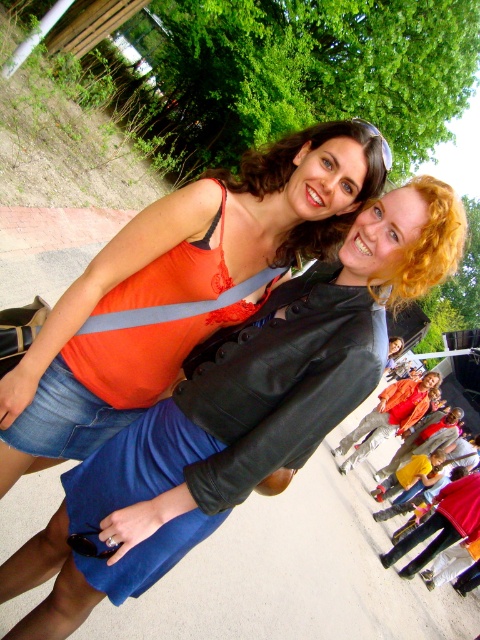
You are standing at the event and want to hand a gift to the person wearing the matte orange tank top at center. If you are currently 2 meters away from them, can you reach them without moving closer?

The matte orange tank top at center is 1.75 meters away from the viewer. Since you are 2 meters away, you cannot reach them without moving closer.

You are designing a layout for a catalog and need to place the matte orange tank top at center and clear plastic goggles at upper center. Given their sizes, which object should be placed higher up to maintain visual balance?

The matte orange tank top at center has a greater height compared to clear plastic goggles at upper center, so placing the matte orange tank top at center lower and the clear plastic goggles at upper center higher would help maintain visual balance by counterbalancing their sizes.

You are a photographer trying to adjust the lighting for a photo shoot. You notice the matte orange tank top at center and the black plastic goggles at lower center. Which object is positioned more to the left side of the image?

The black plastic goggles at lower center are positioned more to the left side of the image because the matte orange tank top at center is to the right of them.